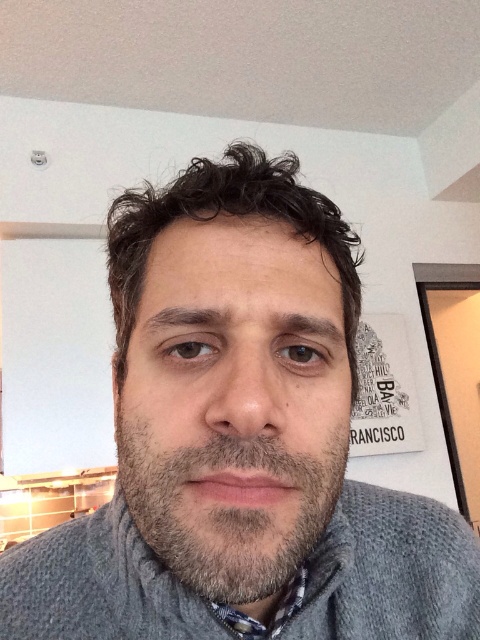
Question: Which point is farther to the camera?

Choices:
 (A) gray knitted sweater at center
 (B) dark brown curly hair at center
 (C) patterned fabric shirt at lower center

Answer: (C)

Question: Is dark brown curly hair at center positioned in front of patterned fabric shirt at lower center?

Choices:
 (A) yes
 (B) no

Answer: (A)

Question: Which object is closer to the camera taking this photo?

Choices:
 (A) gray matte beard at center
 (B) patterned fabric shirt at lower center
 (C) dark brown curly hair at center

Answer: (A)

Question: Which object appears closest to the camera in this image?

Choices:
 (A) dark brown curly hair at center
 (B) gray matte beard at center
 (C) patterned fabric shirt at lower center

Answer: (B)

Question: Does gray knitted sweater at center have a smaller size compared to gray matte beard at center?

Choices:
 (A) yes
 (B) no

Answer: (B)

Question: Considering the relative positions of gray matte beard at center and dark brown curly hair at center in the image provided, where is gray matte beard at center located with respect to dark brown curly hair at center?

Choices:
 (A) above
 (B) below

Answer: (B)